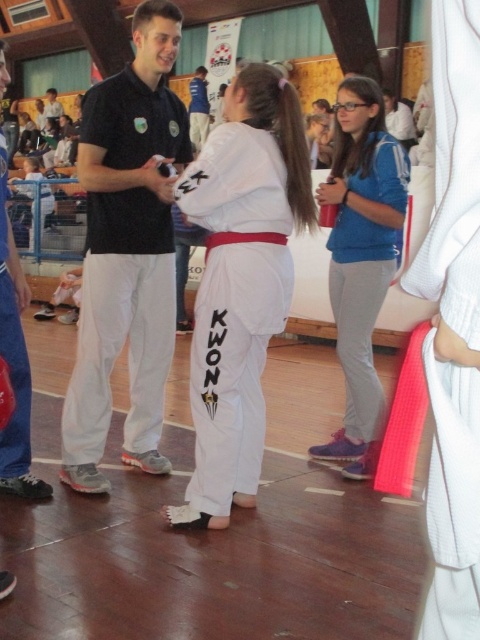
You are a photographer at the event and want to take a picture of both the black matte shirt at center and the white cotton karate gi at center. Since you can only focus on one object at a time, which one should you focus on first if you want to capture them in the correct spatial order from left to right?

You should focus on the black matte shirt at center first because it is positioned to the left of the white cotton karate gi at center, following the left to right spatial order.

Consider the image. You are a photographer positioned at the back of the gym. You need to capture a photo where both the black matte shirt at center and the white cotton karate gi at center are visible. Given their positions, which object should be placed closer to the camera to ensure both are fully visible in the frame?

The black matte shirt at center is taller than the white cotton karate gi at center, so to ensure both are fully visible in the frame, the white cotton karate gi at center should be placed closer to the camera.

You are standing in the gymnasium and want to move from point (373,97) to point (0,198). Which direction should you move to get closer to the camera?

To move closer to the camera, you should move towards point (0,198) because it is closer to the camera than point (373,97).